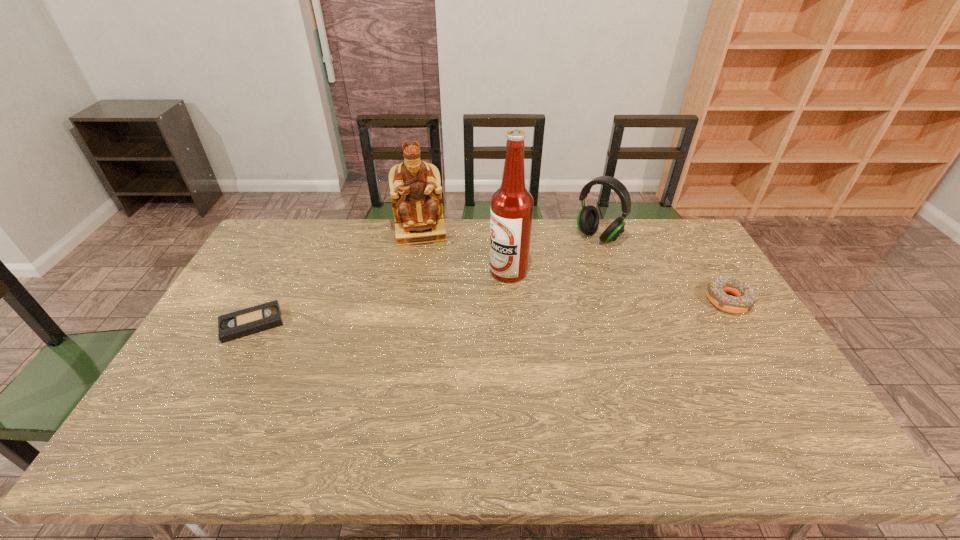
This screenshot has width=960, height=540. What are the coordinates of `the leftmost object` in the screenshot? It's located at (242, 323).

This screenshot has height=540, width=960. What are the coordinates of `the shortest object` in the screenshot? It's located at (242, 323).

In order to click on the second shortest object in this screenshot , I will do `click(745, 298)`.

Find the location of a particular element. The height and width of the screenshot is (540, 960). the rightmost object is located at coordinates (745, 298).

I want to click on the third tallest object, so click(588, 217).

Where is `headset`? The width and height of the screenshot is (960, 540). headset is located at coordinates point(588,217).

Locate an element on the screen. This screenshot has width=960, height=540. alcohol is located at coordinates (512, 204).

You are a GUI agent. You are given a task and a screenshot of the screen. Output one action in this format:
    pyautogui.click(x=<x>, y=<y>)
    Task: Click on the tallest object
    The height and width of the screenshot is (540, 960).
    Given the screenshot: What is the action you would take?
    pyautogui.click(x=512, y=204)

This screenshot has height=540, width=960. I want to click on figurine, so click(x=415, y=186).

The width and height of the screenshot is (960, 540). Find the location of `the fourth shortest object`. the fourth shortest object is located at coordinates (415, 186).